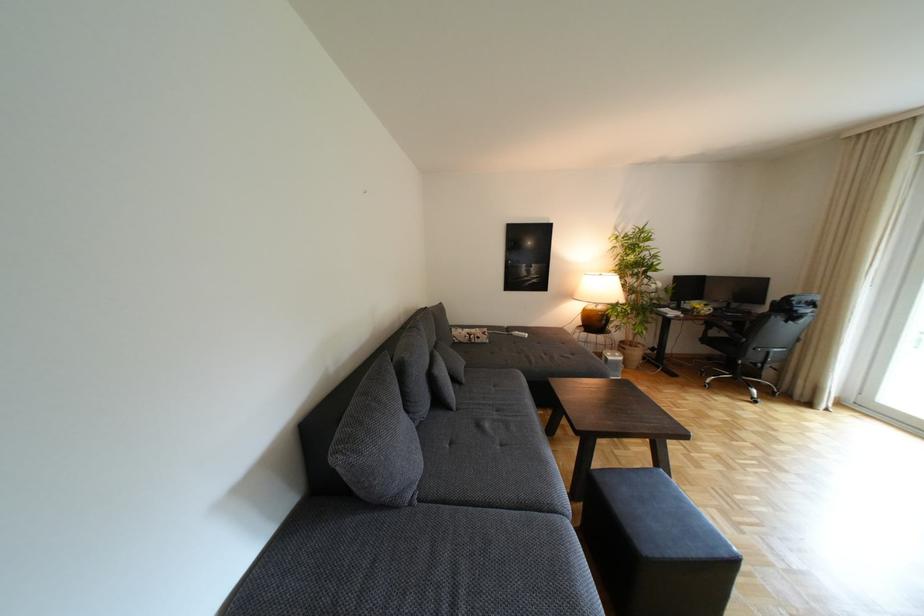
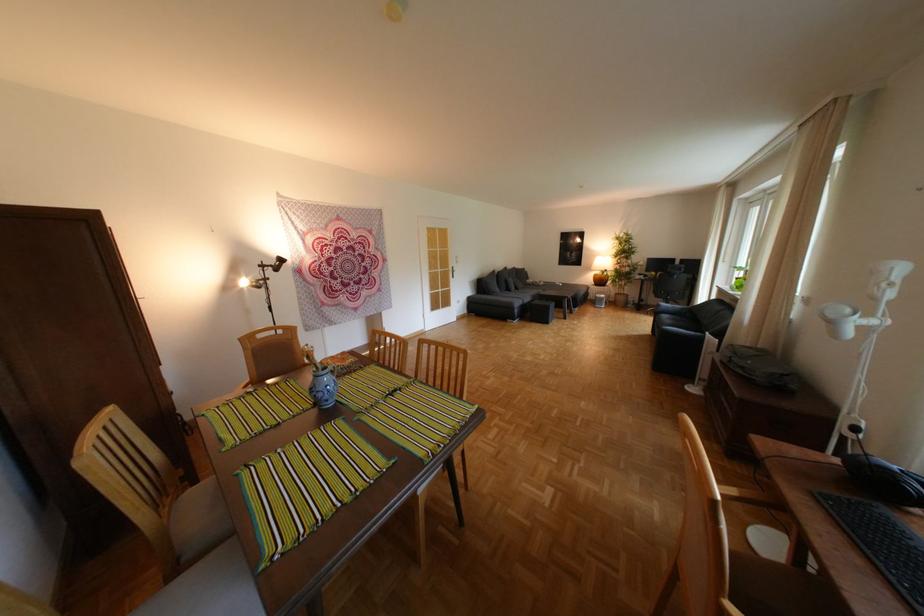
The point at (x=582, y=297) is marked in the first image. Where is the corresponding point in the second image?

(602, 268)